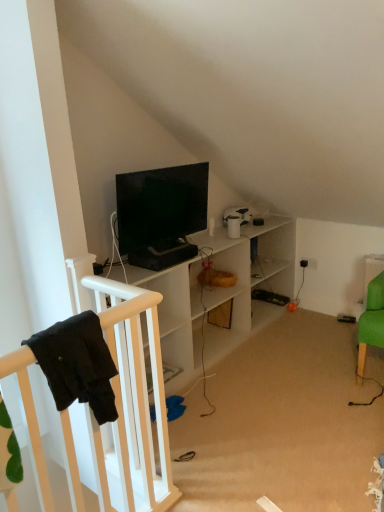
Question: Does black fabric infant bed at left have a larger size compared to matte black tv at center?

Choices:
 (A) yes
 (B) no

Answer: (B)

Question: Does black fabric infant bed at left turn towards matte black tv at center?

Choices:
 (A) no
 (B) yes

Answer: (A)

Question: Considering the relative sizes of black fabric infant bed at left and matte black tv at center in the image provided, is black fabric infant bed at left taller than matte black tv at center?

Choices:
 (A) yes
 (B) no

Answer: (B)

Question: Is black fabric infant bed at left surrounding matte black tv at center?

Choices:
 (A) no
 (B) yes

Answer: (A)

Question: Does black fabric infant bed at left lie behind matte black tv at center?

Choices:
 (A) yes
 (B) no

Answer: (B)

Question: From a real-world perspective, is black fabric infant bed at left positioned over matte black tv at center based on gravity?

Choices:
 (A) yes
 (B) no

Answer: (B)

Question: From a real-world perspective, is matte black tv at center physically below black fabric infant bed at left?

Choices:
 (A) no
 (B) yes

Answer: (A)

Question: Can you confirm if matte black tv at center is bigger than black fabric infant bed at left?

Choices:
 (A) no
 (B) yes

Answer: (B)

Question: Considering the relative positions of matte black tv at center and black fabric infant bed at left in the image provided, is matte black tv at center behind black fabric infant bed at left?

Choices:
 (A) no
 (B) yes

Answer: (B)

Question: Does matte black tv at center lie in front of black fabric infant bed at left?

Choices:
 (A) yes
 (B) no

Answer: (B)

Question: Is matte black tv at center far away from black fabric infant bed at left?

Choices:
 (A) no
 (B) yes

Answer: (A)

Question: Considering the relative positions of matte black tv at center and black fabric infant bed at left in the image provided, is matte black tv at center to the left of black fabric infant bed at left from the viewer's perspective?

Choices:
 (A) yes
 (B) no

Answer: (B)

Question: Is point (168, 458) closer or farther from the camera than point (188, 253)?

Choices:
 (A) closer
 (B) farther

Answer: (A)